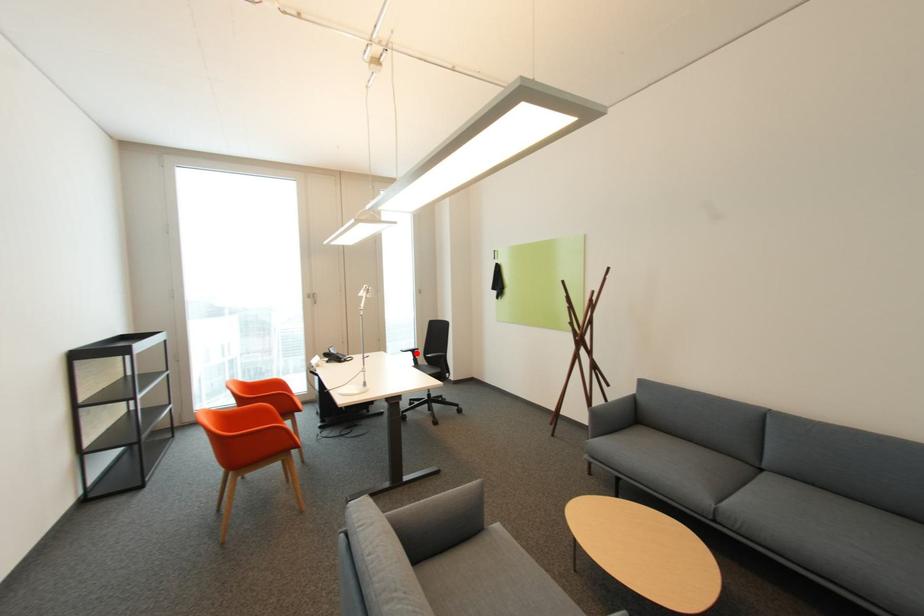
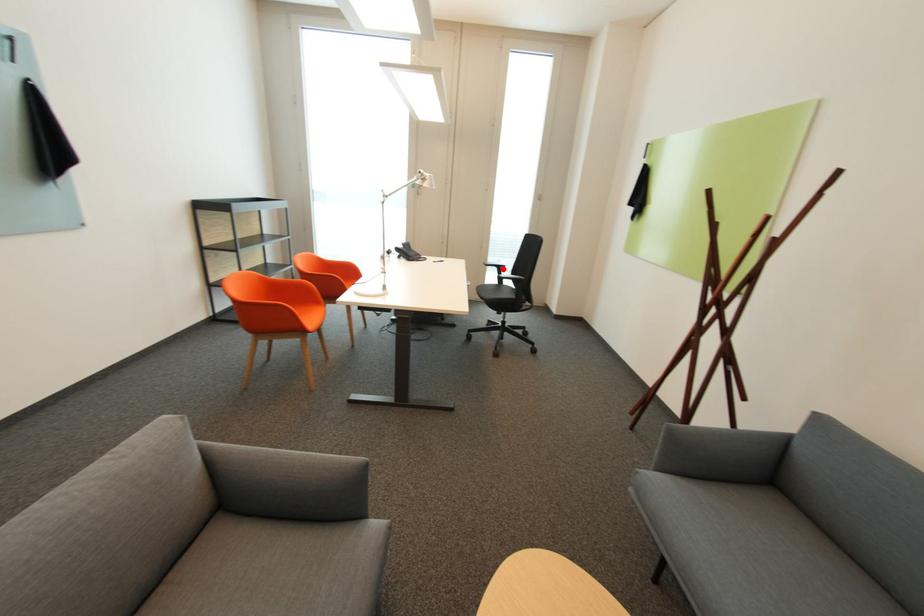
I am providing you with two images of the same scene from different viewpoints. A red point is marked on the first image and another point is marked on the second image. Does the point marked in image1 correspond to the same location as the one in image2?

Yes